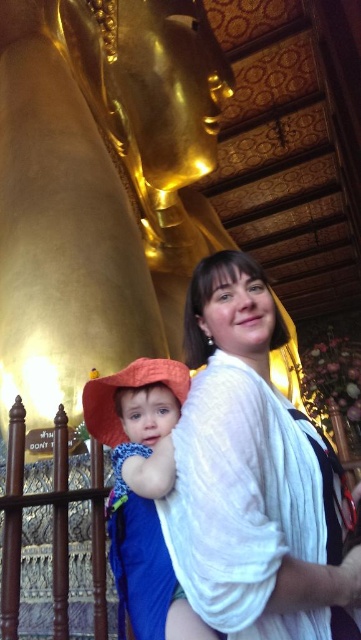
Is white sheer fabric at center to the right of orange fabric hat at lower left from the viewer's perspective?

Indeed, white sheer fabric at center is positioned on the right side of orange fabric hat at lower left.

Between white sheer fabric at center and orange fabric hat at lower left, which one has more height?

white sheer fabric at center

Is point (211, 442) less distant than point (133, 381)?

That is True.

Where is `white sheer fabric at center`? This screenshot has width=361, height=640. white sheer fabric at center is located at coordinates (253, 477).

Is point (181, 595) positioned after point (163, 596)?

That is True.

The height and width of the screenshot is (640, 361). Describe the element at coordinates (140, 497) in the screenshot. I see `orange fabric hat at left` at that location.

What are the coordinates of `orange fabric hat at left` in the screenshot? It's located at (140, 497).

Can you confirm if white sheer fabric at center is taller than orange fabric hat at left?

Yes.

Can you confirm if white sheer fabric at center is wider than orange fabric hat at left?

Yes.

The width and height of the screenshot is (361, 640). I want to click on white sheer fabric at center, so click(x=253, y=477).